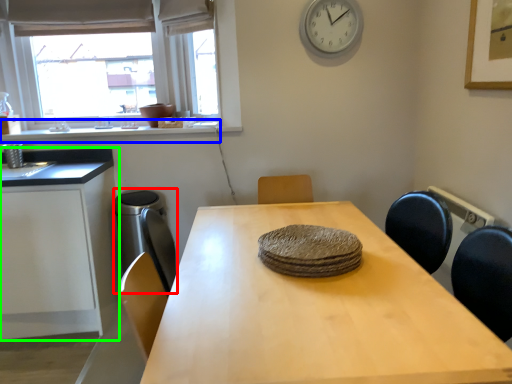
Question: Which object is positioned closest to appliance (highlighted by a red box)? Select from window sill (highlighted by a blue box) and cabinetry (highlighted by a green box).

Choices:
 (A) window sill
 (B) cabinetry

Answer: (B)